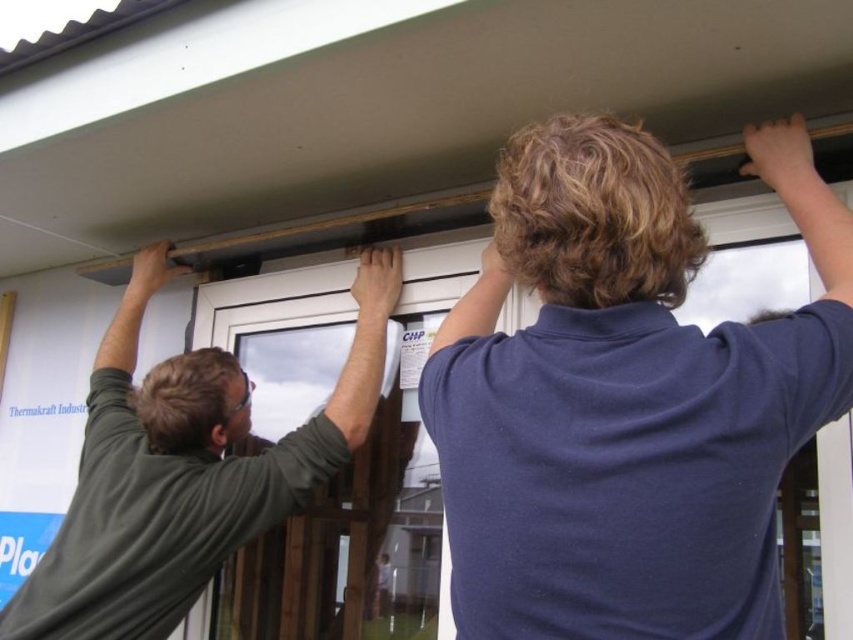
Consider the image. You are a safety inspector observing the construction workers. Which worker is closer to you, the dark blue shirt at upper center or the dark green shirt at upper left?

The dark blue shirt at upper center is closer to you because it is positioned in front of the dark green shirt at upper left.

From the picture: You are a contractor assessing the height of two workers holding a plank. The workers are wearing a dark blue shirt at upper center and a dark green shirt at upper left. Which worker is shorter?

The dark blue shirt at upper center is shorter than the dark green shirt at upper left, so the worker in the dark blue shirt at upper center is shorter.